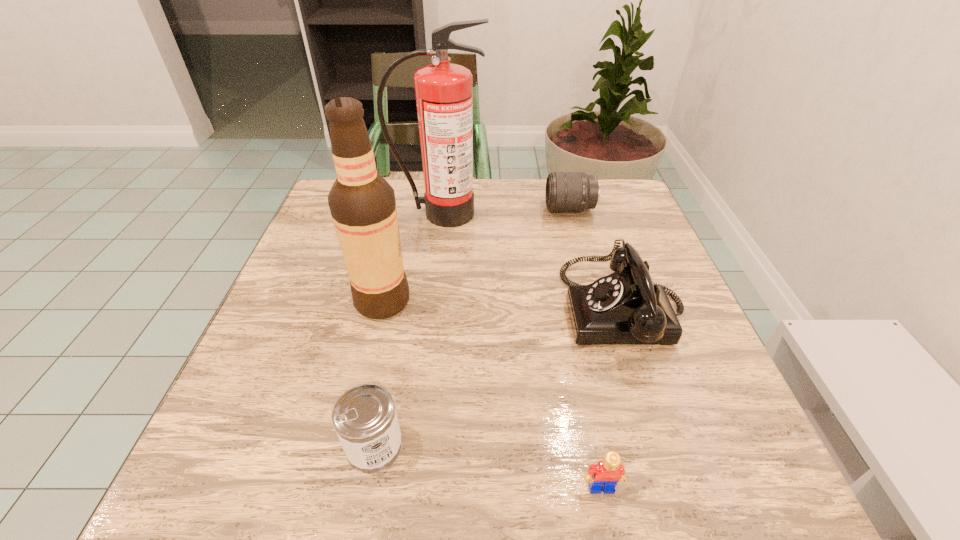
Image resolution: width=960 pixels, height=540 pixels. In order to click on telephone located in the right edge section of the desktop in this screenshot , I will do `click(626, 307)`.

Find the location of a particular element. The height and width of the screenshot is (540, 960). telephoto lens present at the right edge is located at coordinates (565, 191).

Identify the location of object present at the far right corner. (565, 191).

At what (x,y) coordinates should I click in order to perform the action: click on vacant region at the far edge. Please return your answer as a coordinate pair (x, y). This screenshot has width=960, height=540. Looking at the image, I should click on (488, 223).

In the image, there is a desktop. At what (x,y) coordinates should I click in order to perform the action: click on vacant space at the near edge. Please return your answer as a coordinate pair (x, y). Image resolution: width=960 pixels, height=540 pixels. Looking at the image, I should click on (308, 469).

In the image, there is a desktop. Where is `free region at the left edge`? This screenshot has width=960, height=540. free region at the left edge is located at coordinates (332, 323).

The height and width of the screenshot is (540, 960). I want to click on vacant space at the right edge, so click(702, 400).

Find the location of a particular element. vacant space at the near left corner of the desktop is located at coordinates (298, 455).

Where is `free spot at the far right corner of the desktop`? The height and width of the screenshot is (540, 960). free spot at the far right corner of the desktop is located at coordinates pyautogui.click(x=623, y=205).

I want to click on free space at the near right corner of the desktop, so click(x=756, y=460).